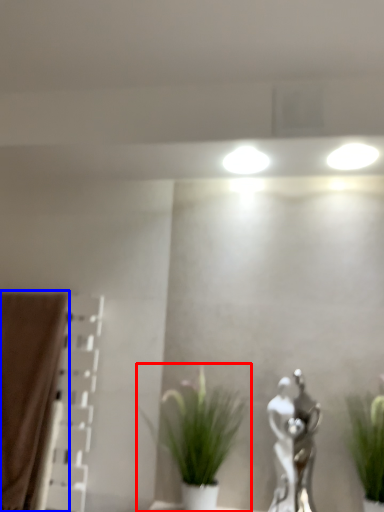
Question: Which of the following is the closest to the observer, houseplant (highlighted by a red box) or curtain (highlighted by a blue box)?

Choices:
 (A) houseplant
 (B) curtain

Answer: (A)